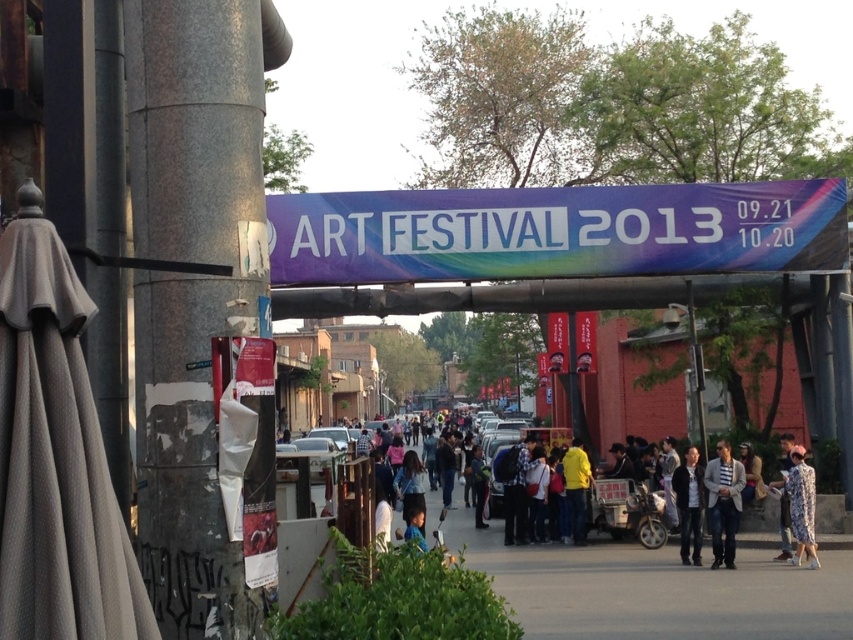
You are a photographer at the ART FESTIVAL 2013. You need to capture both the striped cotton shirt at center and the floral dress at center in a single frame. Which of these two items should you focus on first to ensure both are in the frame without moving the camera?

The striped cotton shirt at center is smaller than the floral dress at center, so you should focus on the floral dress at center first to ensure both are in the frame without moving the camera.

You are an artist at the 2013 art festival and you want to wear both the striped cotton shirt at center and the dark gray jacket at center. Which one should you put on first to match the current layering as seen in the image?

The striped cotton shirt at center is positioned over the dark gray jacket at center, so you should put on the dark gray jacket at center first and then the striped cotton shirt at center to match the layering shown.